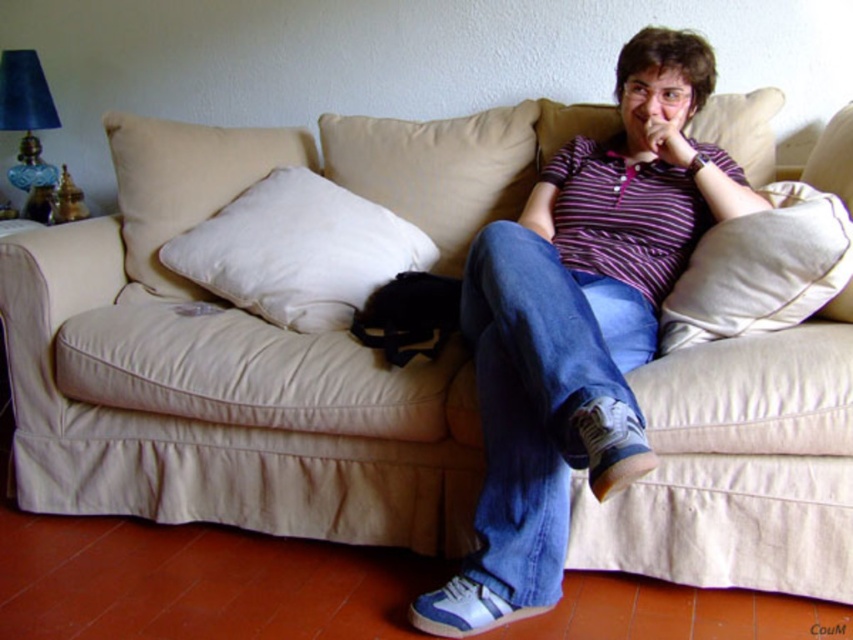
You are designing a living room layout and want to ensure that the white soft pillow at center and the matte purple shirt at upper center are placed in a way that the pillow is wider than the shirt. Given the current scene, does the arrangement already satisfy this requirement?

Yes, the arrangement already satisfies the requirement because the white soft pillow at center has a larger width than the matte purple shirt at upper center.

You are a guest entering the living room and want to sit on the sofa. Which object, the white soft pillow at center or the white soft cushion at center, is closer to you when you approach the sofa?

The white soft pillow at center is closer to you than the white soft cushion at center.

You are a guest in the living room and want to sit on the sofa. The host tells you to sit on the white soft cushion at center. However, you notice the white soft pillow at center is also there. Which one is closer to the floor?

The white soft pillow at center is below the white soft cushion at center, so the white soft pillow at center is closer to the floor.